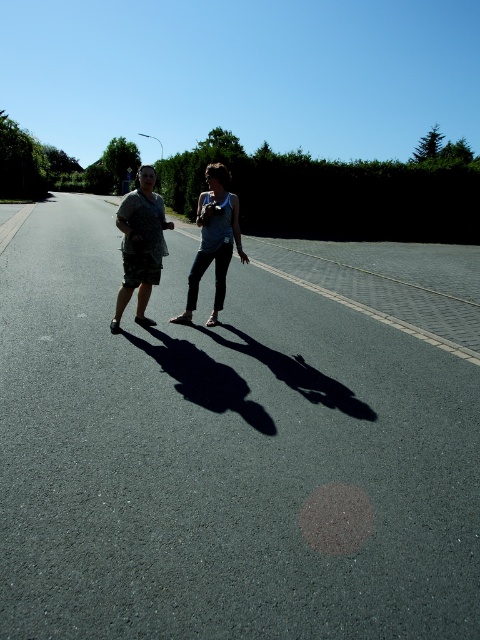
Question: Which point is closer to the camera?

Choices:
 (A) camouflage shorts at center
 (B) camouflage fabric dress at center

Answer: (B)

Question: Can you confirm if camouflage fabric dress at center is positioned to the right of camouflage shorts at center?

Choices:
 (A) no
 (B) yes

Answer: (B)

Question: Does camouflage fabric dress at center appear under camouflage shorts at center?

Choices:
 (A) no
 (B) yes

Answer: (A)

Question: Which point appears closest to the camera in this image?

Choices:
 (A) (146, 216)
 (B) (121, 241)

Answer: (A)

Question: Is camouflage fabric dress at center further to camera compared to camouflage shorts at center?

Choices:
 (A) no
 (B) yes

Answer: (A)